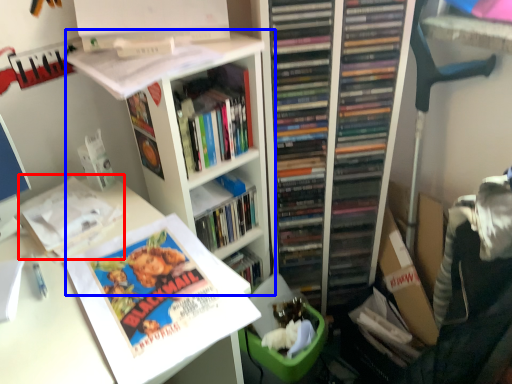
Question: Among these objects, which one is nearest to the camera, book (highlighted by a red box) or bookshelf (highlighted by a blue box)?

Choices:
 (A) book
 (B) bookshelf

Answer: (B)